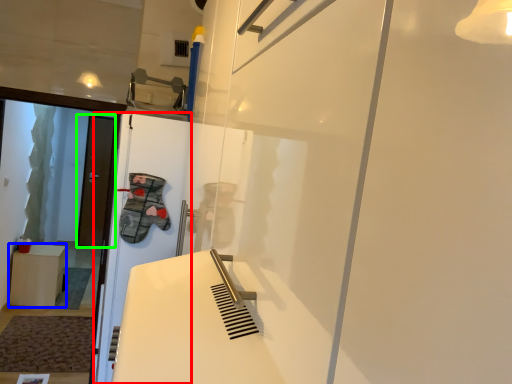
Question: Which object is the closest to the screen door (highlighted by a red box)? Choose among these: furniture (highlighted by a blue box) or door (highlighted by a green box).

Choices:
 (A) furniture
 (B) door

Answer: (A)